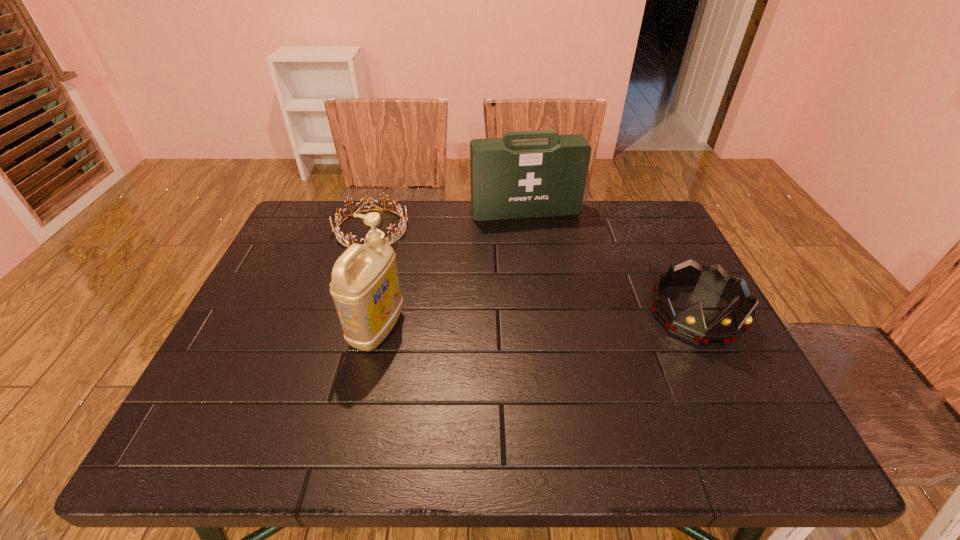
At what (x,y) coordinates should I click in order to perform the action: click on detergent. Please return your answer as a coordinate pair (x, y). This screenshot has width=960, height=540. Looking at the image, I should click on (365, 287).

Where is `the rightmost object`? the rightmost object is located at coordinates (689, 324).

Where is `the second shortest object`? Image resolution: width=960 pixels, height=540 pixels. the second shortest object is located at coordinates (689, 324).

Where is `the third object from left to right`? The image size is (960, 540). the third object from left to right is located at coordinates (510, 179).

Locate an element on the screen. This screenshot has height=540, width=960. the left tiara is located at coordinates (402, 220).

Locate an element on the screen. Image resolution: width=960 pixels, height=540 pixels. the shorter tiara is located at coordinates (402, 220).

I want to click on vacant space located 0.060m on the left of the detergent, so click(326, 329).

I want to click on vacant space located 0.050m at the front of the nearer tiara with jewels, so click(x=723, y=369).

The image size is (960, 540). I want to click on vacant region located 0.100m on the front-facing side of the second object from right to left, so click(x=540, y=241).

Where is `free location located on the front-facing side of the second object from right to left`? free location located on the front-facing side of the second object from right to left is located at coordinates (562, 304).